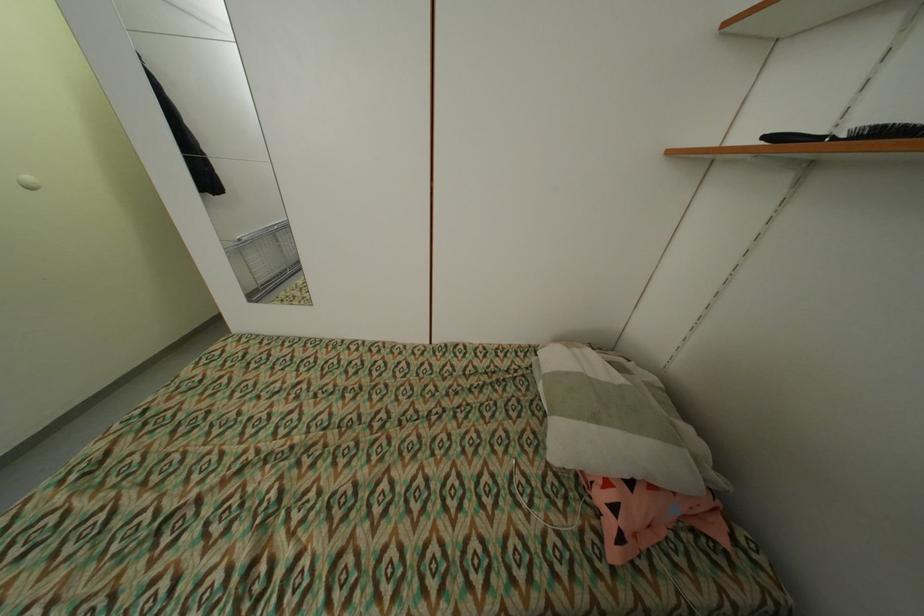
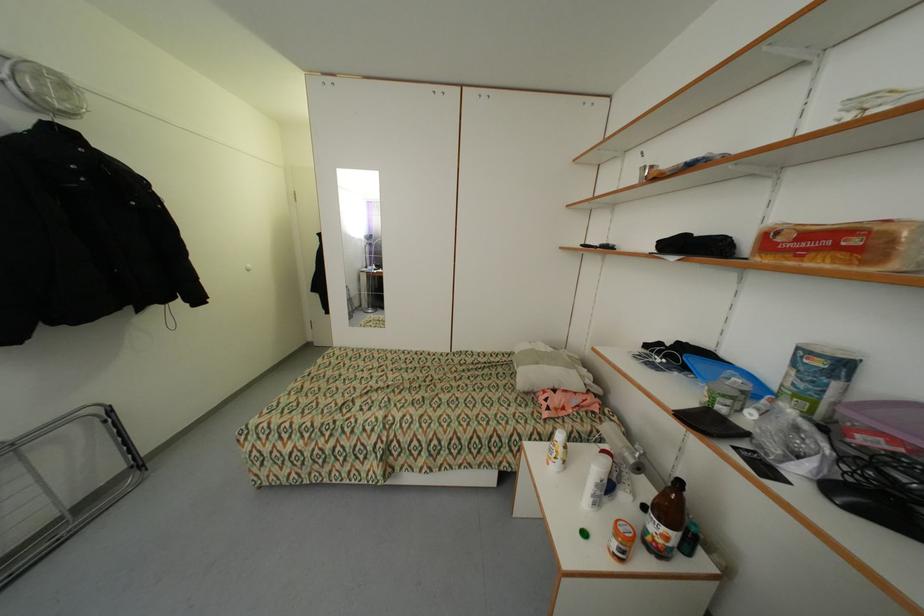
Find the pixel in the second image that matches point 841,140 in the first image.

(602, 248)